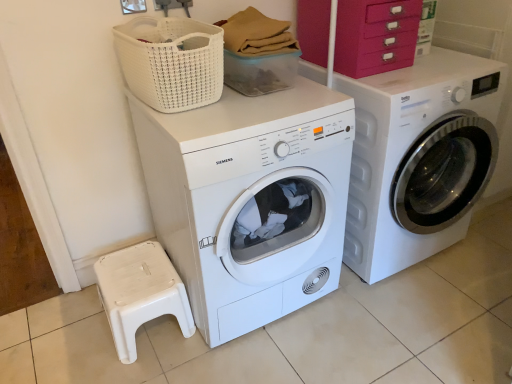
Identify the location of vacant area that is in front of white glossy washing machine at right, the 2th washing machine from the left. (403, 327).